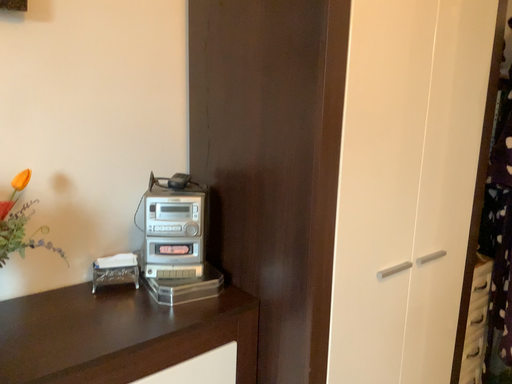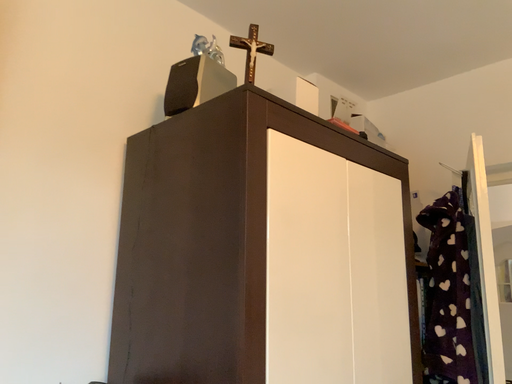
Question: How did the camera likely rotate when shooting the video?

Choices:
 (A) rotated downward
 (B) rotated upward

Answer: (B)